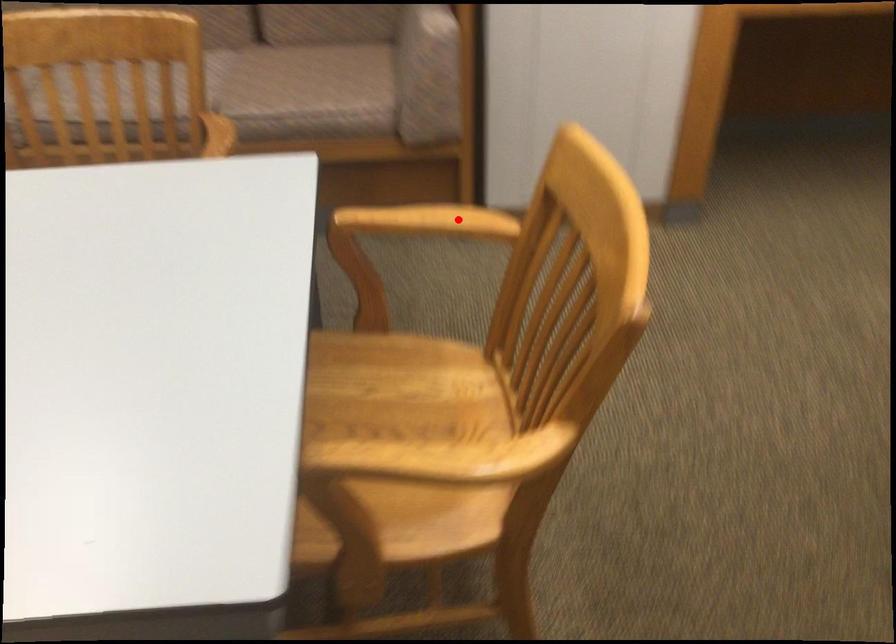
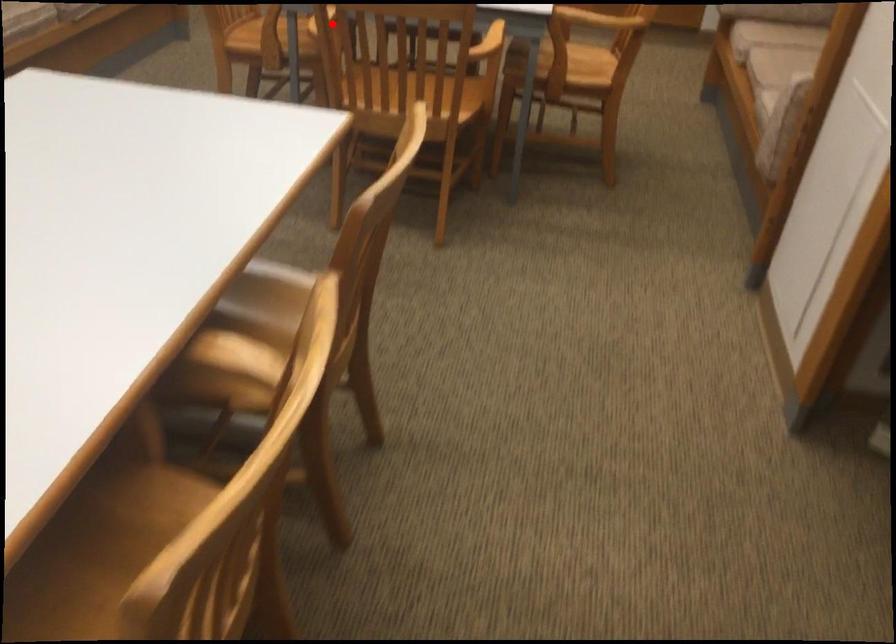
I am providing you with two images of the same scene from different viewpoints. A red point is marked on the first image and another point is marked on the second image. Are the points marked in image1 and image2 representing the same 3D position?

No